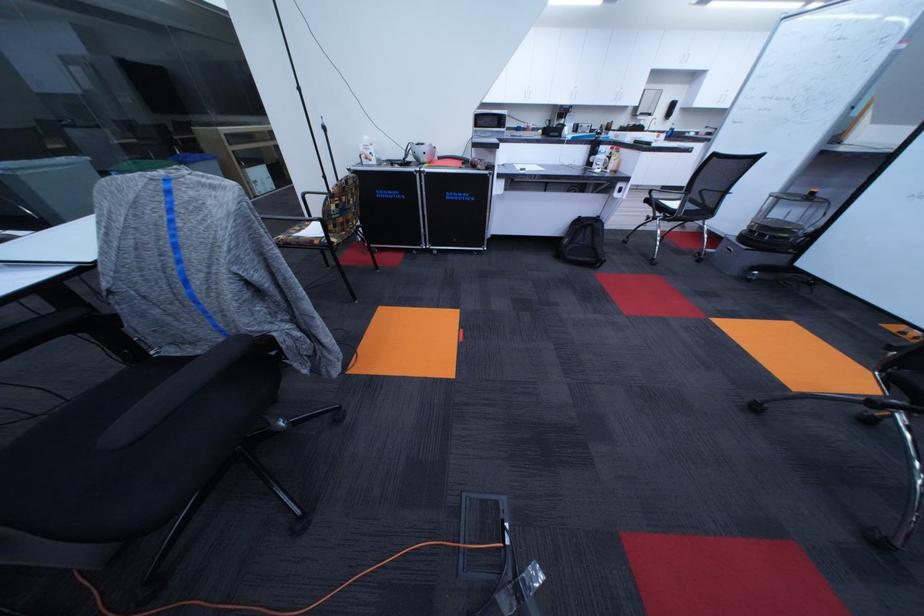
At what (x,y) coordinates should I click in order to perform the action: click on patterned chair armrest. Please return your answer as a coordinate pair (x, y). The width and height of the screenshot is (924, 616). Looking at the image, I should click on (175, 392).